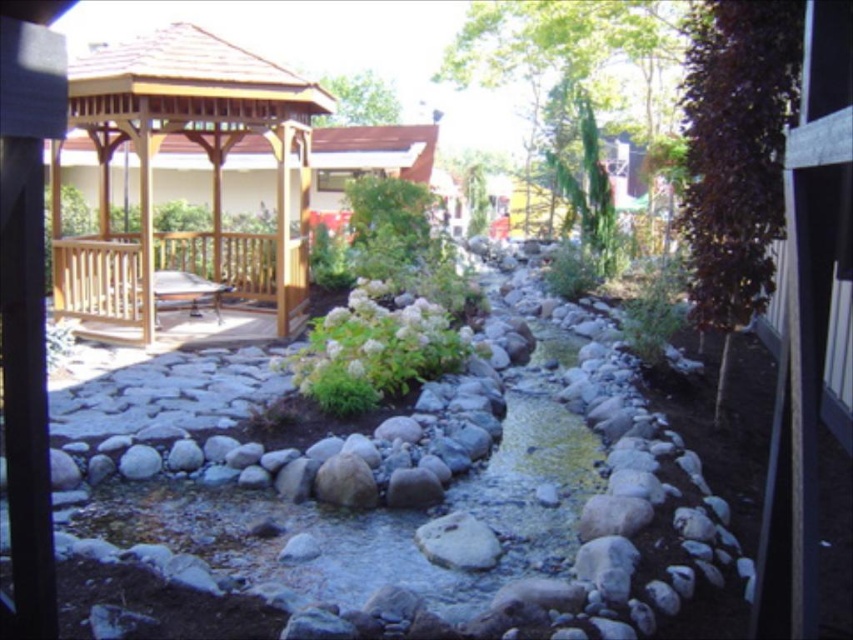
In the scene shown: Is wooden gazebo at upper left bigger than white fluffy bush at center?

Incorrect, wooden gazebo at upper left is not larger than white fluffy bush at center.

Consider the image. Is wooden gazebo at upper left smaller than white fluffy bush at center?

Correct, wooden gazebo at upper left occupies less space than white fluffy bush at center.

Which is in front, point (194, 77) or point (357, 358)?

Point (357, 358) is in front.

The image size is (853, 640). Find the location of `wooden gazebo at upper left`. wooden gazebo at upper left is located at coordinates (201, 150).